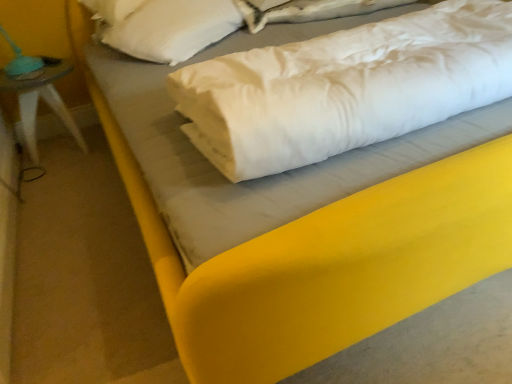
What are the coordinates of `white satin sheet at upper center` in the screenshot? It's located at click(308, 10).

Locate an element on the screen. Image resolution: width=512 pixels, height=384 pixels. teal fabric lampshade at left is located at coordinates (38, 101).

Locate an element on the screen. This screenshot has width=512, height=384. white soft pillow at center is located at coordinates (345, 87).

Find the location of a particular element. Image resolution: width=512 pixels, height=384 pixels. white satin sheet at upper center is located at coordinates (308, 10).

What's the angular difference between white soft pillow at upper left and teal fabric lampshade at left's facing directions?

The facing directions of white soft pillow at upper left and teal fabric lampshade at left are 35.1 degrees apart.

I want to click on pillow on the right of teal fabric lampshade at left, so click(164, 26).

Considering the sizes of white soft pillow at upper left and teal fabric lampshade at left in the image, is white soft pillow at upper left wider or thinner than teal fabric lampshade at left?

In the image, white soft pillow at upper left appears to be wider than teal fabric lampshade at left.

Is white soft pillow at upper left far from teal fabric lampshade at left?

No.

Who is bigger, white satin sheet at upper center or teal fabric lampshade at left?

teal fabric lampshade at left is bigger.

From the image's perspective, who appears lower, white satin sheet at upper center or teal fabric lampshade at left?

teal fabric lampshade at left is shown below in the image.

In the scene shown: Can we say white satin sheet at upper center lies outside teal fabric lampshade at left?

Absolutely, white satin sheet at upper center is external to teal fabric lampshade at left.

Is white soft pillow at upper left aimed at white soft pillow at center?

Yes, white soft pillow at upper left is aimed at white soft pillow at center.

From the image's perspective, which is above, white soft pillow at upper left or white soft pillow at center?

white soft pillow at upper left, from the image's perspective.

Is white soft pillow at center positioned in front of teal fabric lampshade at left?

Yes, it is.

Which object is wider, white soft pillow at center or teal fabric lampshade at left?

With larger width is white soft pillow at center.

Is white soft pillow at center touching teal fabric lampshade at left?

white soft pillow at center is not next to teal fabric lampshade at left, and they're not touching.

Between point (226, 68) and point (189, 14), which one is positioned behind?

The point (189, 14) is farther.

Does white soft pillow at center appear on the left side of white soft pillow at upper left?

In fact, white soft pillow at center is to the right of white soft pillow at upper left.

This screenshot has height=384, width=512. Identify the location of pillow located on the left of white soft pillow at center. (164, 26).

From a real-world perspective, is white soft pillow at center located beneath white soft pillow at upper left?

Yes, from a real-world perspective, white soft pillow at center is beneath white soft pillow at upper left.

Is white soft pillow at center positioned far away from white satin sheet at upper center?

Actually, white soft pillow at center and white satin sheet at upper center are a little close together.

Is the position of white soft pillow at center more distant than that of white satin sheet at upper center?

No, the depth of white soft pillow at center is less than that of white satin sheet at upper center.

How many degrees apart are the facing directions of white soft pillow at center and white satin sheet at upper center?

There is a 0.000553-degree angle between the facing directions of white soft pillow at center and white satin sheet at upper center.

Does white soft pillow at center turn towards white satin sheet at upper center?

No, white soft pillow at center is not aimed at white satin sheet at upper center.

Relative to white soft pillow at center, is white satin sheet at upper center in front or behind?

white satin sheet at upper center is positioned farther from the viewer than white soft pillow at center.

Is white satin sheet at upper center turned away from white soft pillow at center?

No, white satin sheet at upper center's orientation is not away from white soft pillow at center.

Is white satin sheet at upper center far away from white soft pillow at center?

No.

This screenshot has height=384, width=512. In order to click on pillow above the teal fabric lampshade at left (from a real-world perspective) in this screenshot , I will do `click(164, 26)`.

Where is `furniture located on the left of white satin sheet at upper center`? The height and width of the screenshot is (384, 512). furniture located on the left of white satin sheet at upper center is located at coordinates (38, 101).

Based on their spatial positions, is white soft pillow at upper left or white satin sheet at upper center further from teal fabric lampshade at left?

Based on the image, white satin sheet at upper center appears to be further to teal fabric lampshade at left.

Estimate the real-world distances between objects in this image. Which object is further from white soft pillow at upper left, white satin sheet at upper center or white soft pillow at center?

Based on the image, white soft pillow at center appears to be further to white soft pillow at upper left.

Which object lies further to the anchor point teal fabric lampshade at left, white soft pillow at center or white satin sheet at upper center?

white soft pillow at center is further to teal fabric lampshade at left.

From the image, which object appears to be nearer to white satin sheet at upper center, white soft pillow at upper left or teal fabric lampshade at left?

white soft pillow at upper left is positioned closer to the anchor white satin sheet at upper center.

Estimate the real-world distances between objects in this image. Which object is further from white soft pillow at upper left, white soft pillow at center or white satin sheet at upper center?

white soft pillow at center.

Looking at this image, looking at the image, which one is located further to white soft pillow at upper left, teal fabric lampshade at left or white satin sheet at upper center?

teal fabric lampshade at left.

Which object lies nearer to the anchor point white soft pillow at center, teal fabric lampshade at left or white soft pillow at upper left?

The object closer to white soft pillow at center is white soft pillow at upper left.

When comparing their distances from white satin sheet at upper center, does white soft pillow at upper left or white soft pillow at center seem further?

white soft pillow at center lies further to white satin sheet at upper center than the other object.

You are a GUI agent. You are given a task and a screenshot of the screen. Output one action in this format:
    pyautogui.click(x=<x>, y=<y>)
    Task: Click on the linen between teal fabric lampshade at left and white satin sheet at upper center in the horizontal direction
    This screenshot has width=512, height=384.
    Given the screenshot: What is the action you would take?
    pyautogui.click(x=345, y=87)

The height and width of the screenshot is (384, 512). What are the coordinates of `pillow located between teal fabric lampshade at left and white satin sheet at upper center in the left-right direction` in the screenshot? It's located at (164, 26).

Find the location of a particular element. pillow between teal fabric lampshade at left and white soft pillow at center from left to right is located at coordinates [x=164, y=26].

Where is `pillow between white soft pillow at center and white satin sheet at upper center along the z-axis`? pillow between white soft pillow at center and white satin sheet at upper center along the z-axis is located at coordinates point(164,26).